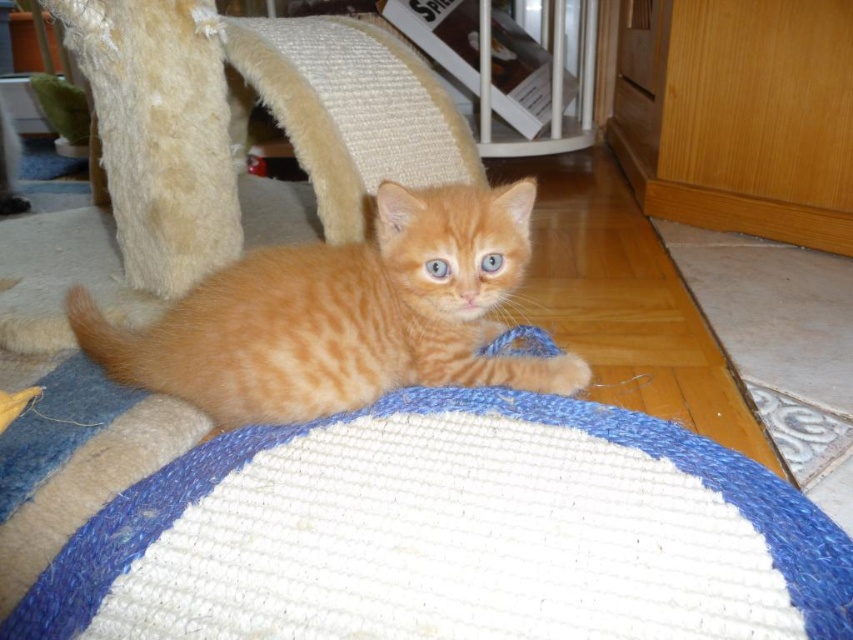
Which of these two, white knitted cat bed at center or orange fur cat at center, stands taller?

orange fur cat at center is taller.

Is white knitted cat bed at center smaller than orange fur cat at center?

No.

Locate an element on the screen. This screenshot has height=640, width=853. white knitted cat bed at center is located at coordinates (326, 426).